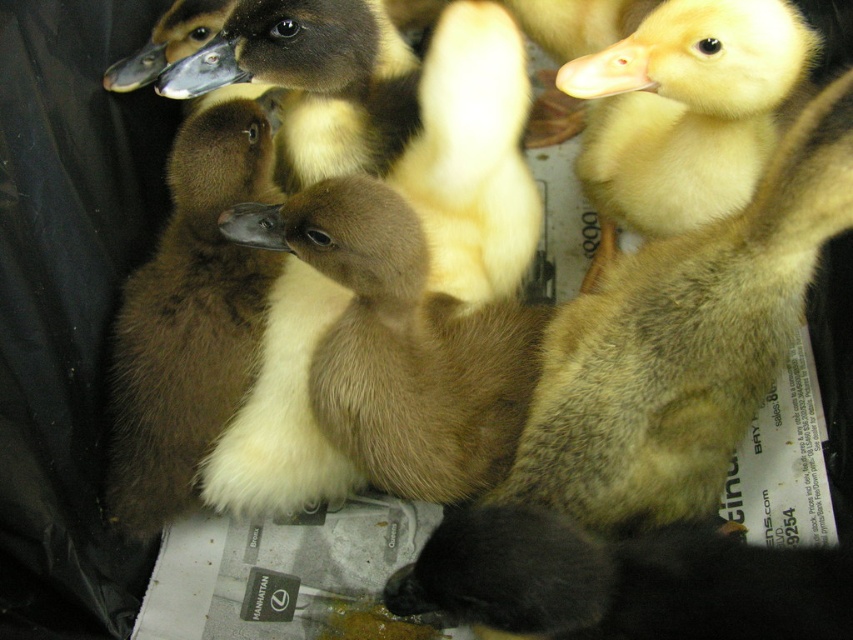
Which of these two, brown fluffy duckling at center or brown fuzzy duckling at center, stands shorter?

brown fluffy duckling at center

Image resolution: width=853 pixels, height=640 pixels. Identify the location of brown fluffy duckling at center. (401, 344).